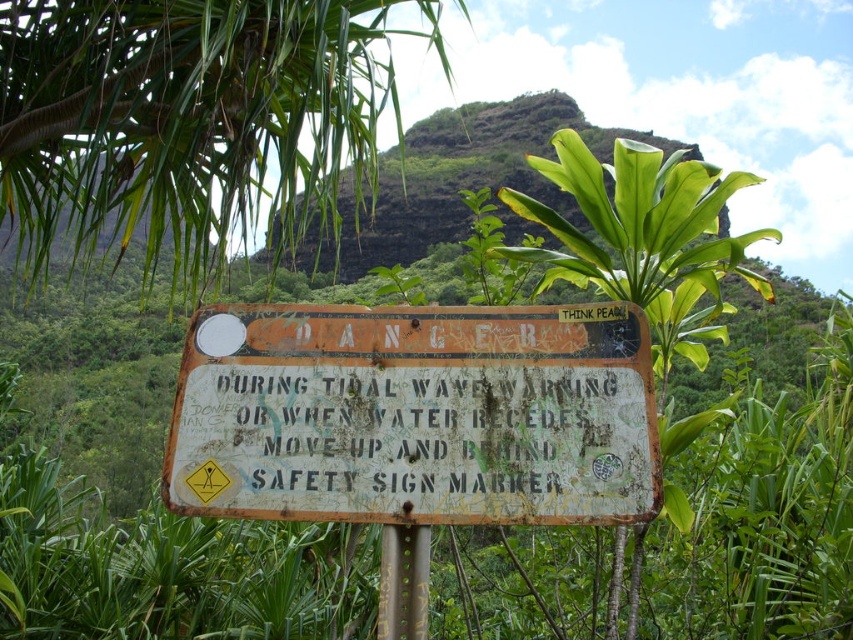
Question: Estimate the real-world distances between objects in this image. Which object is closer to the rusty metal sign at center?

Choices:
 (A) green rock at center
 (B) rusty metal pole at center
 (C) green leafy plant at upper center

Answer: (B)

Question: Is rusty metal sign at center to the right of rusty metal pole at center from the viewer's perspective?

Choices:
 (A) yes
 (B) no

Answer: (B)

Question: Is rusty metal sign at center thinner than rusty metal pole at center?

Choices:
 (A) no
 (B) yes

Answer: (A)

Question: Based on their relative distances, which object is nearer to the rusty metal pole at center?

Choices:
 (A) green rock at center
 (B) rusty metal sign at center

Answer: (B)

Question: Estimate the real-world distances between objects in this image. Which object is closer to the rusty metal sign at center?

Choices:
 (A) rusty metal pole at center
 (B) green leafy plant at upper center

Answer: (A)

Question: Can you confirm if rusty metal sign at center is positioned above rusty metal pole at center?

Choices:
 (A) no
 (B) yes

Answer: (B)